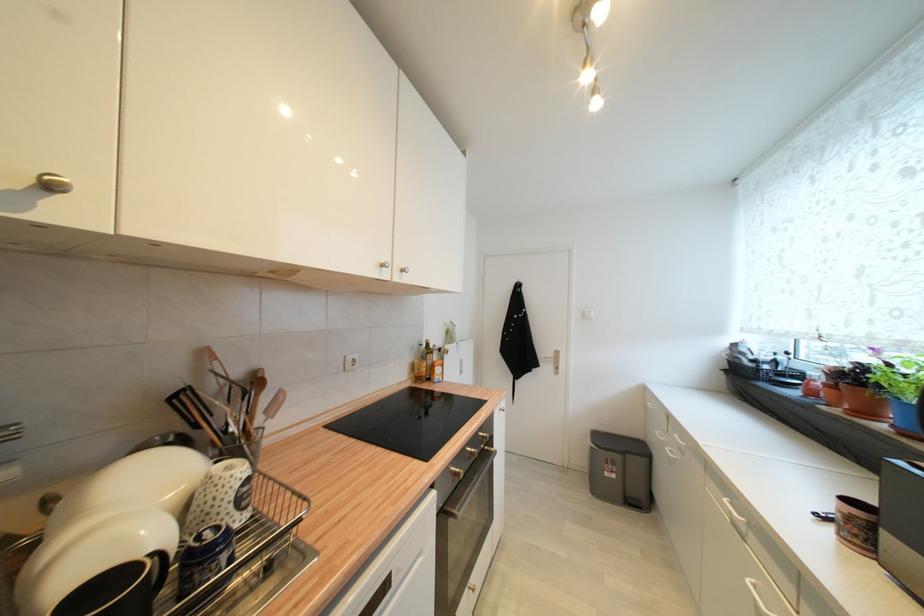
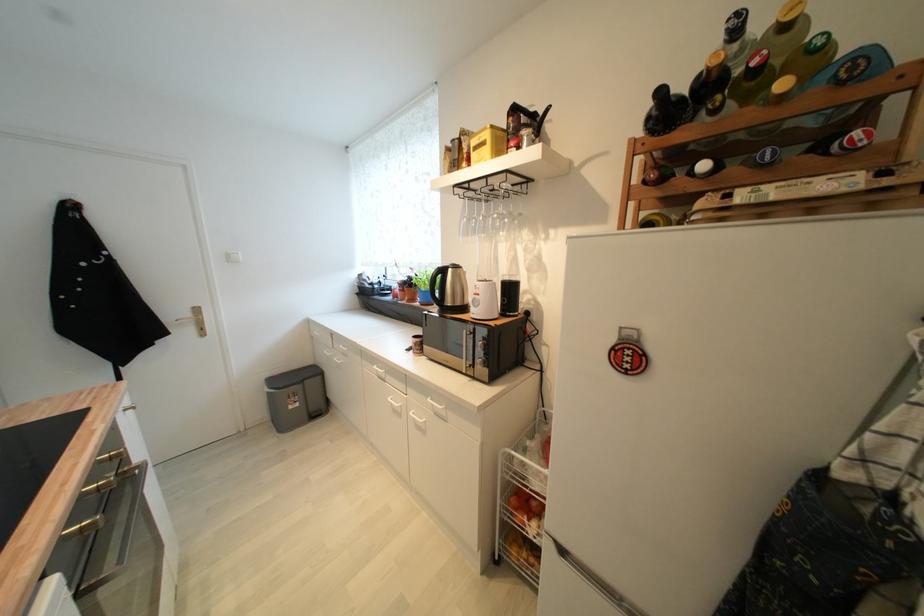
Locate, in the second image, the point that corresponds to (x=732, y=501) in the first image.

(380, 369)